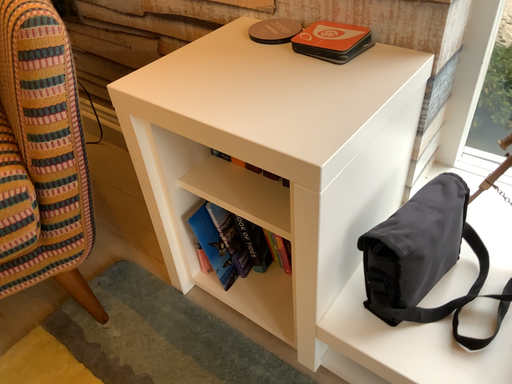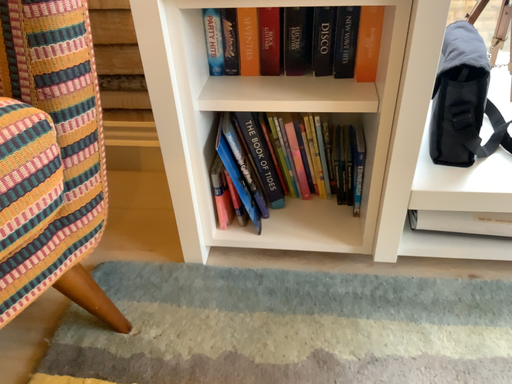
Question: How did the camera likely rotate when shooting the video?

Choices:
 (A) rotated left
 (B) rotated right

Answer: (B)